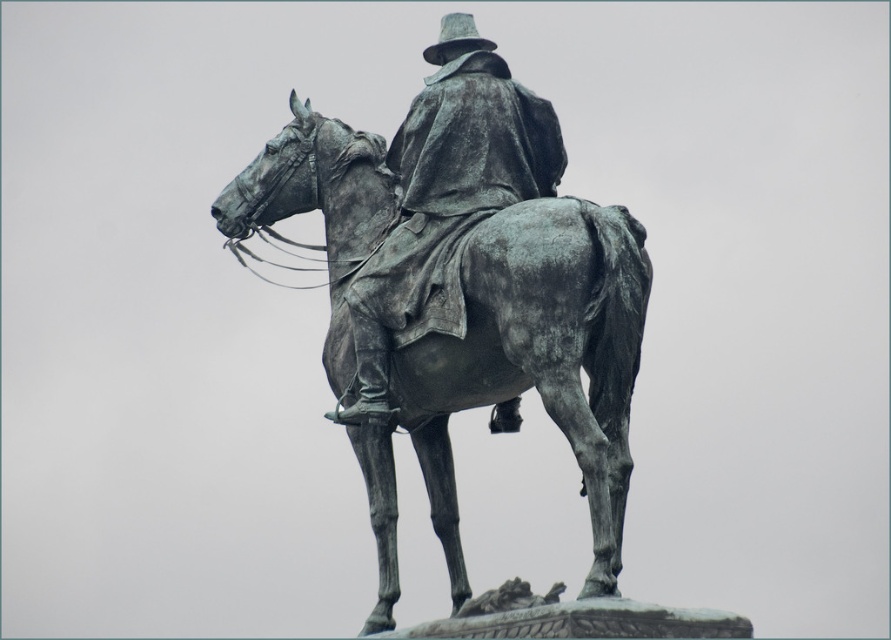
Question: Does bronze statue horse at center appear over bronze statue at center?

Choices:
 (A) no
 (B) yes

Answer: (A)

Question: Among these objects, which one is nearest to the camera?

Choices:
 (A) bronze statue horse at center
 (B) bronze statue at center

Answer: (A)

Question: Among these objects, which one is farthest from the camera?

Choices:
 (A) bronze statue at center
 (B) bronze statue horse at center

Answer: (A)

Question: Can you confirm if bronze statue horse at center is positioned to the right of bronze statue at center?

Choices:
 (A) no
 (B) yes

Answer: (A)

Question: Which of the following is the closest to the observer?

Choices:
 (A) (599, 291)
 (B) (486, 176)

Answer: (A)

Question: Does bronze statue horse at center lie behind bronze statue at center?

Choices:
 (A) yes
 (B) no

Answer: (B)